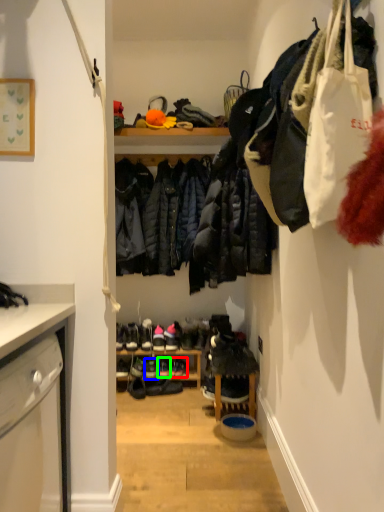
Question: Based on their relative distances, which object is farther from footwear (highlighted by a red box)? Choose from footwear (highlighted by a blue box) and footwear (highlighted by a green box).

Choices:
 (A) footwear
 (B) footwear

Answer: (A)